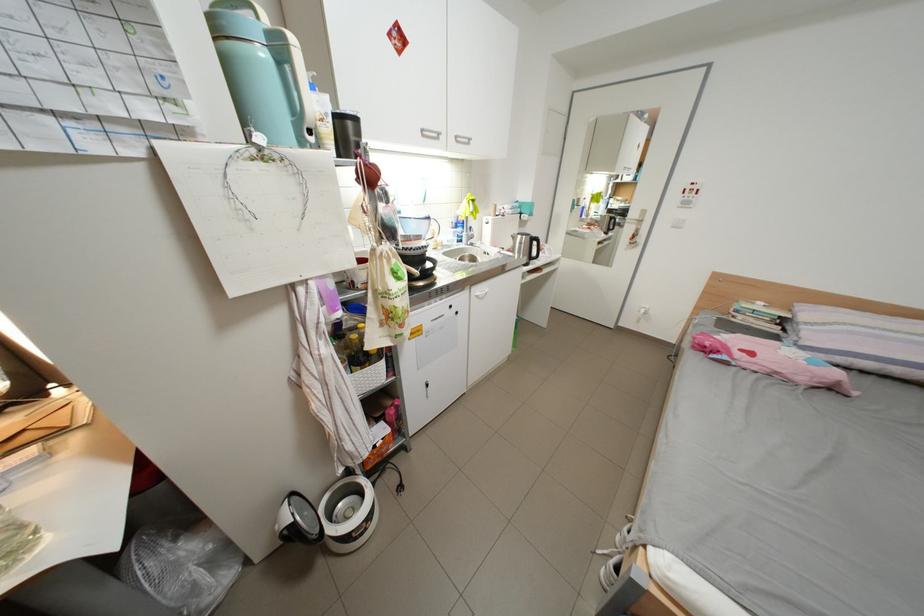
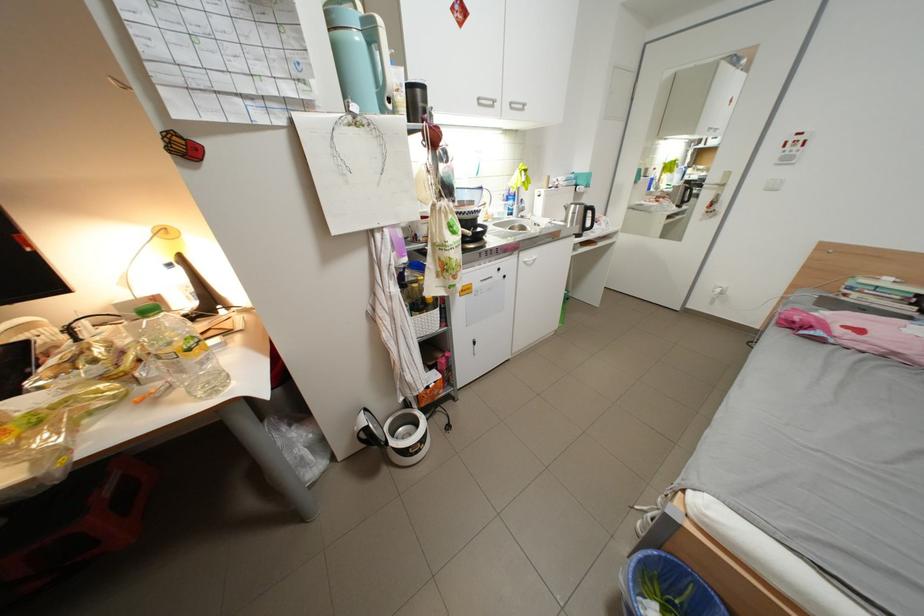
Find the pixel in the second image that matches point 434,132 in the first image.

(490, 100)